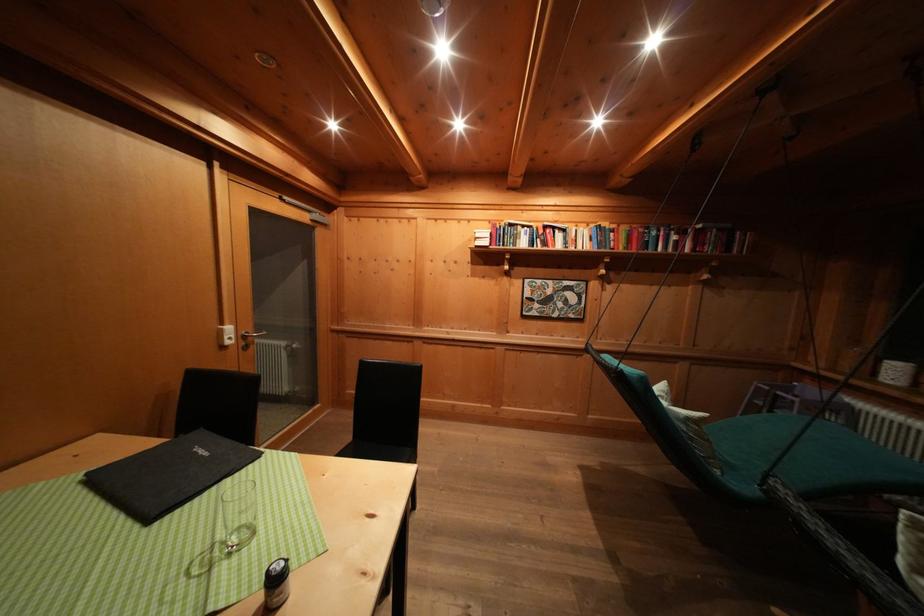
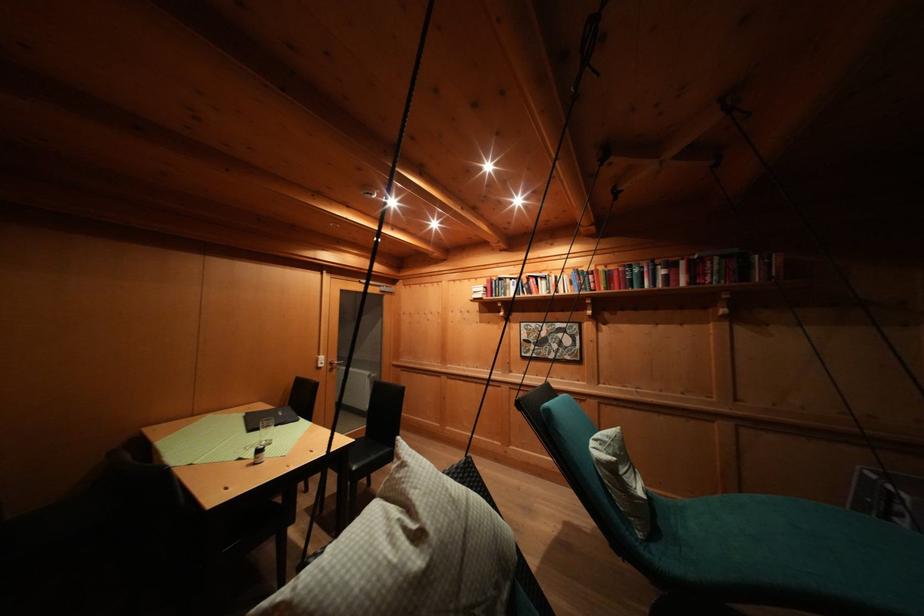
Locate, in the second image, the point that corresponds to the point at 162,515 in the first image.

(259, 434)